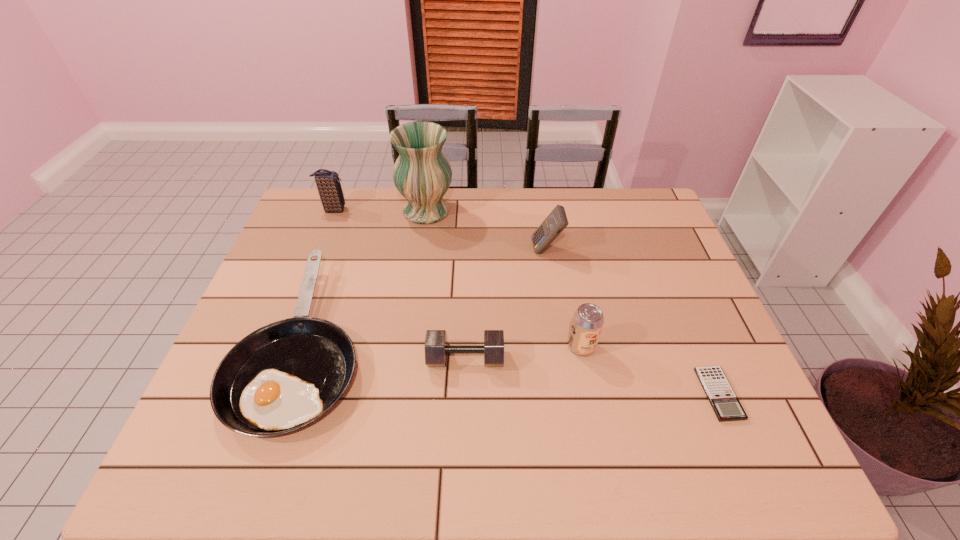
At what (x,y) coordinates should I click in order to perform the action: click on vase. Please return your answer as a coordinate pair (x, y). Image resolution: width=960 pixels, height=540 pixels. Looking at the image, I should click on (422, 174).

At what (x,y) coordinates should I click in order to perform the action: click on clutch bag. Please return your answer as a coordinate pair (x, y). The height and width of the screenshot is (540, 960). Looking at the image, I should click on (329, 188).

You are a GUI agent. You are given a task and a screenshot of the screen. Output one action in this format:
    pyautogui.click(x=<x>, y=<y>)
    Task: Click on the fifth nearest object
    The image size is (960, 540).
    Given the screenshot: What is the action you would take?
    pyautogui.click(x=556, y=221)

Locate an element on the screen. This screenshot has height=540, width=960. the farther calculator is located at coordinates (556, 221).

The height and width of the screenshot is (540, 960). I want to click on the fourth shortest object, so click(x=588, y=319).

Find the location of `the fifth tallest object`. the fifth tallest object is located at coordinates (436, 349).

Locate an element on the screen. the sixth tallest object is located at coordinates (283, 376).

Locate an element on the screen. the rightmost object is located at coordinates (726, 405).

At what (x,y) coordinates should I click in order to perform the action: click on the nearer calculator. Please return your answer as a coordinate pair (x, y). Looking at the image, I should click on (726, 405).

Identify the location of free spot located 0.350m on the front of the vase. (412, 310).